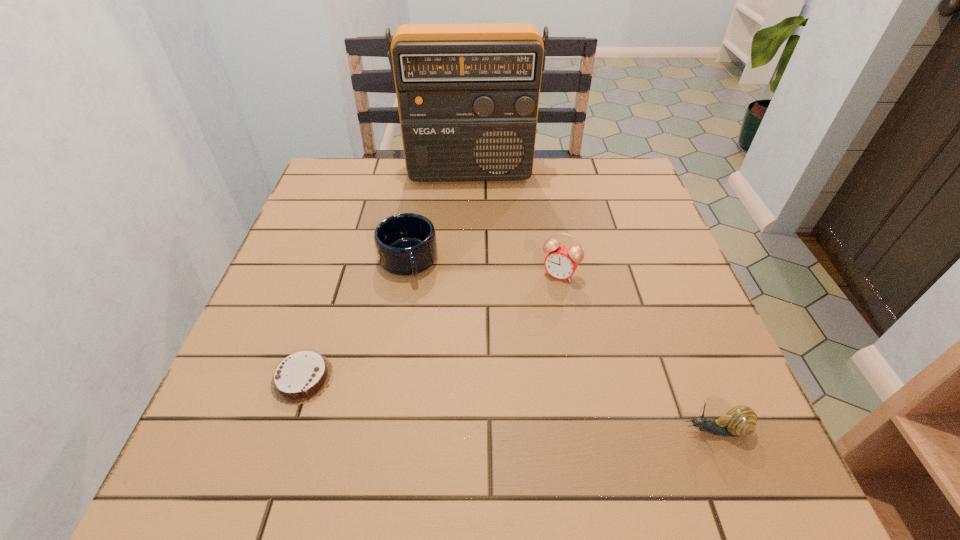
The image size is (960, 540). I want to click on vacant area situated 0.350m with the handle on the side of the third shortest object, so (x=455, y=425).

Find the location of `object that is at the far edge`. object that is at the far edge is located at coordinates (468, 95).

Identify the location of chocolate cake positioned at the near edge. This screenshot has height=540, width=960. coord(301,377).

Where is `escargot that is at the near edge`? The image size is (960, 540). escargot that is at the near edge is located at coordinates (740, 420).

Where is `object present at the left edge`? object present at the left edge is located at coordinates (301, 377).

Identify the location of object situated at the right edge. [740, 420].

Image resolution: width=960 pixels, height=540 pixels. In order to click on object present at the near left corner in this screenshot , I will do `click(301, 377)`.

Locate an element on the screen. Image resolution: width=960 pixels, height=540 pixels. object present at the near right corner is located at coordinates [x=740, y=420].

In the image, there is a desktop. Identify the location of vacant space at the far edge. (525, 187).

Image resolution: width=960 pixels, height=540 pixels. What are the coordinates of `blank space at the near edge of the desktop` in the screenshot? It's located at (542, 387).